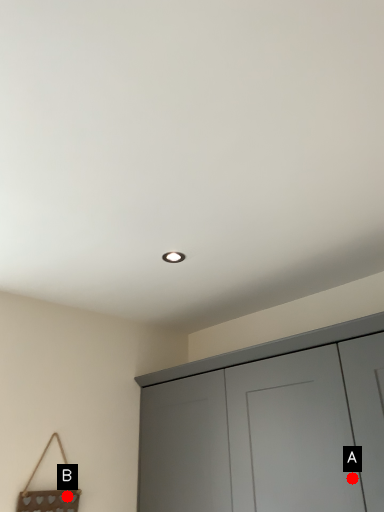
Question: Two points are circled on the image, labeled by A and B beside each circle. Which point is closer to the camera?

Choices:
 (A) A is closer
 (B) B is closer

Answer: (A)